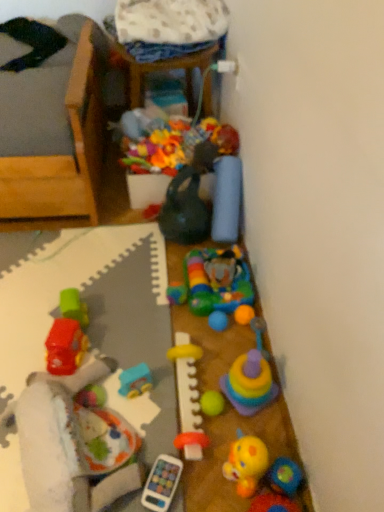
Where is `free location in front of rubberized plastic elephant at center, the 6th toy when ordered from left to right`? This screenshot has width=384, height=512. free location in front of rubberized plastic elephant at center, the 6th toy when ordered from left to right is located at coordinates (202, 337).